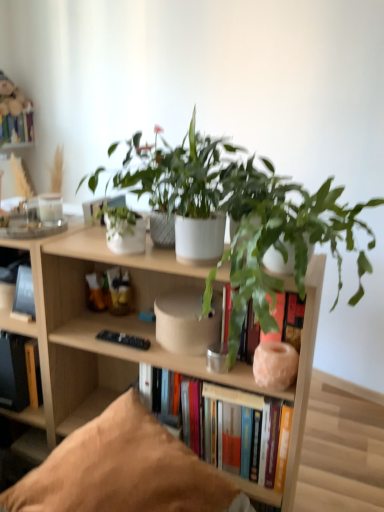
Question: Should I look upward or downward to see black matte book at left, positioned as the second book in front-to-back order?

Choices:
 (A) down
 (B) up

Answer: (A)

Question: Considering the relative sizes of black matte book at left, positioned as the second book in front-to-back order, and matte pink stone vase at center in the image provided, is black matte book at left, positioned as the second book in front-to-back order, bigger than matte pink stone vase at center?

Choices:
 (A) no
 (B) yes

Answer: (B)

Question: Considering the relative sizes of black matte book at left, the third book in the back-to-front sequence, and matte pink stone vase at center in the image provided, is black matte book at left, the third book in the back-to-front sequence, taller than matte pink stone vase at center?

Choices:
 (A) no
 (B) yes

Answer: (B)

Question: Is black matte book at left, which ranks as the third book in left-to-right order, wider than matte pink stone vase at center?

Choices:
 (A) no
 (B) yes

Answer: (A)

Question: Is black matte book at left, the 2th book when ordered from right to left, shorter than matte pink stone vase at center?

Choices:
 (A) no
 (B) yes

Answer: (A)

Question: Is black matte book at left, which ranks as the third book in left-to-right order, to the right of matte pink stone vase at center from the viewer's perspective?

Choices:
 (A) no
 (B) yes

Answer: (A)

Question: From a real-world perspective, does black matte book at left, the 2th book when ordered from right to left, stand above matte pink stone vase at center?

Choices:
 (A) yes
 (B) no

Answer: (A)

Question: Is the surface of matte pink stone vase at center in direct contact with green matte plant at center, positioned as the 1th houseplant in right-to-left order?

Choices:
 (A) no
 (B) yes

Answer: (A)

Question: Is matte pink stone vase at center aimed at green matte plant at center, which ranks as the second houseplant in left-to-right order?

Choices:
 (A) no
 (B) yes

Answer: (B)

Question: Is matte pink stone vase at center oriented away from green matte plant at center, positioned as the 1th houseplant in right-to-left order?

Choices:
 (A) yes
 (B) no

Answer: (A)

Question: From a real-world perspective, is matte pink stone vase at center below green matte plant at center, which ranks as the second houseplant in left-to-right order?

Choices:
 (A) yes
 (B) no

Answer: (A)

Question: Would you say green matte plant at center, which ranks as the second houseplant in left-to-right order, is part of matte pink stone vase at center's contents?

Choices:
 (A) no
 (B) yes

Answer: (A)

Question: Does matte pink stone vase at center have a greater height compared to green matte plant at center, which ranks as the second houseplant in left-to-right order?

Choices:
 (A) yes
 (B) no

Answer: (B)

Question: Is the depth of green matte plant at center, positioned as the 1th houseplant in right-to-left order, greater than that of hardcover books at center, arranged as the 1th book when ordered from the bottom?

Choices:
 (A) no
 (B) yes

Answer: (A)